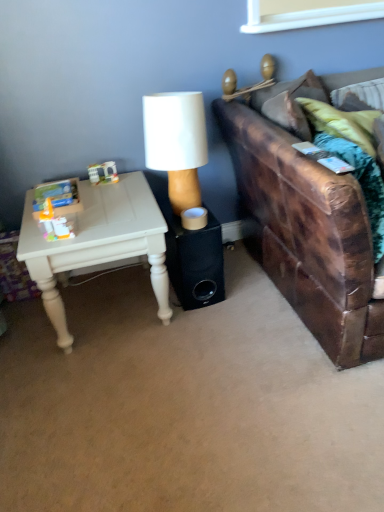
Locate an element on the screen. This screenshot has height=512, width=384. free space to the right of white painted wood table at left is located at coordinates (230, 313).